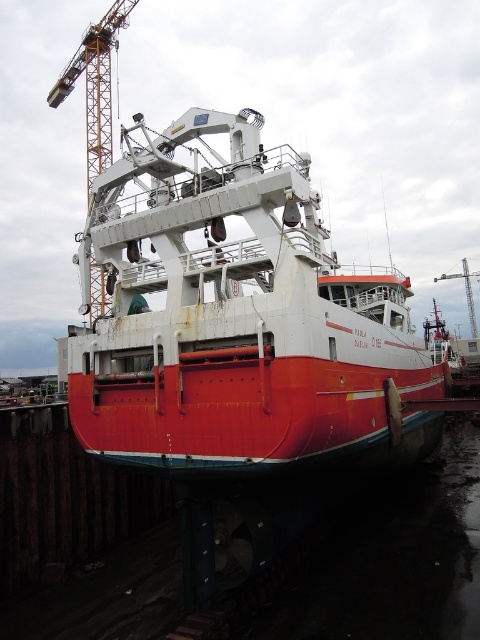
Question: Does metallic yellow crane at upper left appear on the right side of brushed metal crane at upper center?

Choices:
 (A) no
 (B) yes

Answer: (A)

Question: Which point is farther to the camera?

Choices:
 (A) metallic yellow crane at upper left
 (B) brushed metal crane at upper center

Answer: (B)

Question: Which point is closer to the camera?

Choices:
 (A) brushed metal crane at upper center
 (B) metallic yellow crane at upper left
 (C) rusty metal boat at center

Answer: (C)

Question: Which of the following is the farthest from the observer?

Choices:
 (A) brushed metal crane at upper center
 (B) metallic yellow crane at upper left
 (C) rusty metal boat at center

Answer: (A)

Question: Is rusty metal boat at center bigger than metallic yellow crane at upper left?

Choices:
 (A) no
 (B) yes

Answer: (A)

Question: Can you confirm if metallic yellow crane at upper left is positioned above brushed metal crane at upper center?

Choices:
 (A) yes
 (B) no

Answer: (A)